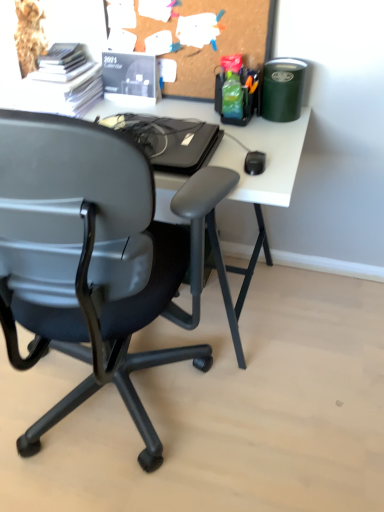
At what (x,y) coordinates should I click in order to perform the action: click on space that is in front of white matte computer desk at upper center. Please return your answer as a coordinate pair (x, y). Looking at the image, I should click on (176, 426).